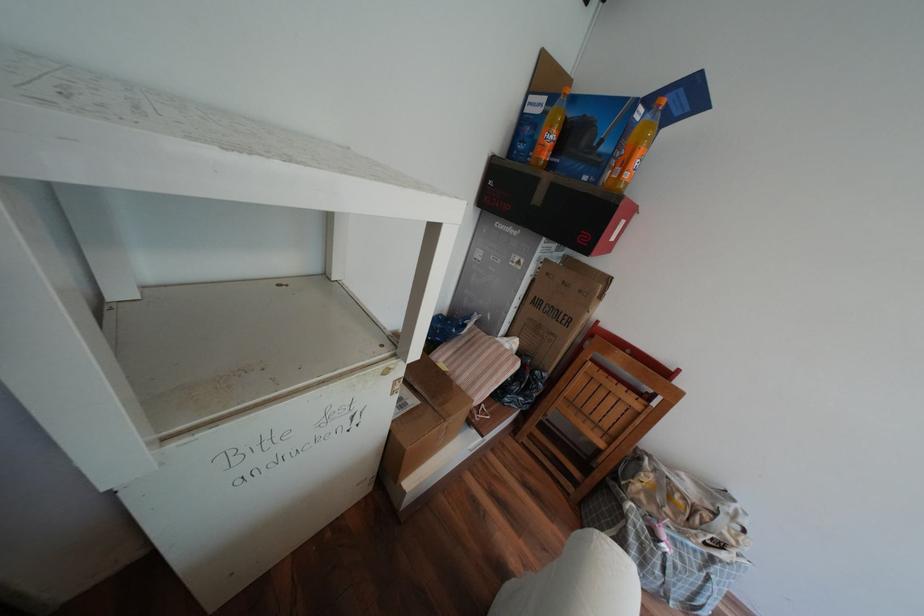
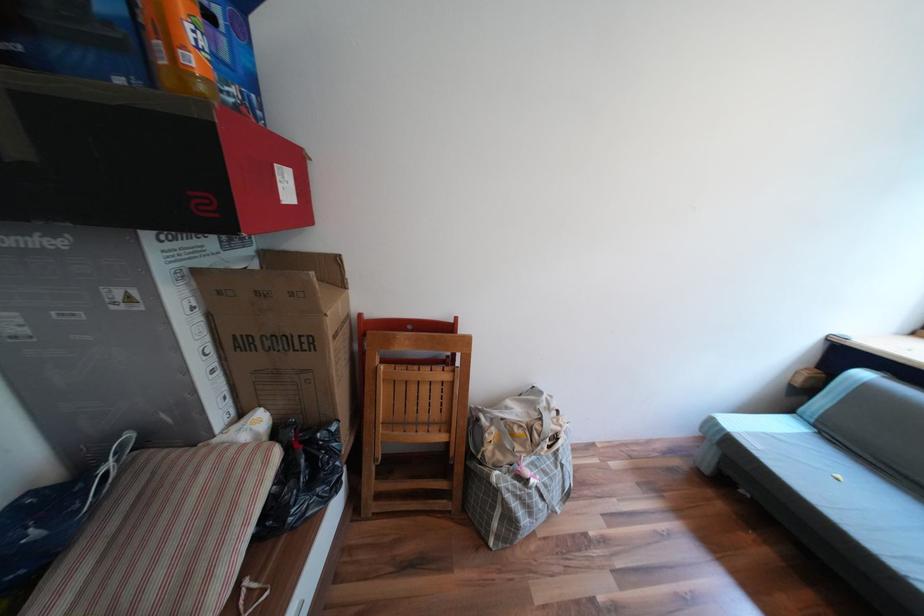
Question: The camera is either moving clockwise (left) or counter-clockwise (right) around the object. The first image is from the beginning of the video and the second image is from the end. Is the camera moving left or right when shooting the video?

Choices:
 (A) Left
 (B) Right

Answer: (A)